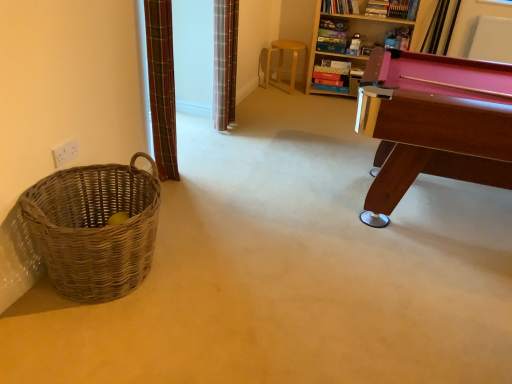
Where is `vacant region in front of woven brown basket at left`? The height and width of the screenshot is (384, 512). vacant region in front of woven brown basket at left is located at coordinates (95, 345).